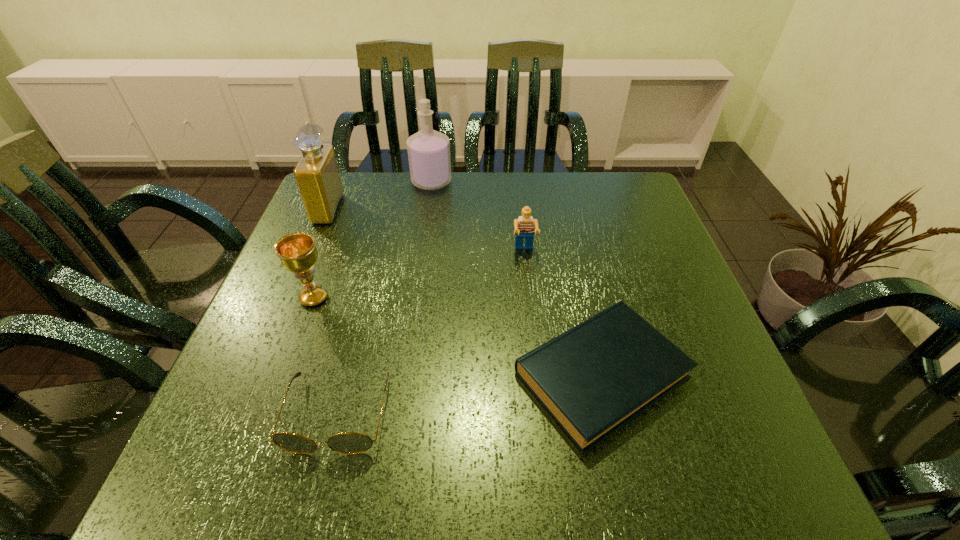
In the image, there is a desktop. Where is `free region at the near right corner`? This screenshot has width=960, height=540. free region at the near right corner is located at coordinates (670, 453).

At what (x,y) coordinates should I click in order to perform the action: click on free space between the third farthest object and the right perfume. Please return your answer as a coordinate pair (x, y). The height and width of the screenshot is (540, 960). Looking at the image, I should click on (478, 216).

The width and height of the screenshot is (960, 540). In order to click on vacant space that's between the shortest object and the fifth tallest object in this screenshot , I will do `click(469, 395)`.

Identify the location of blank region between the chalice and the sunglasses. (325, 356).

Locate an element on the screen. Image resolution: width=960 pixels, height=540 pixels. empty space between the fifth tallest object and the farther perfume is located at coordinates (385, 298).

You are a GUI agent. You are given a task and a screenshot of the screen. Output one action in this format:
    pyautogui.click(x=<x>, y=<y>)
    Task: Click on the empty space between the sunglasses and the shortest object
    This screenshot has height=540, width=960.
    Given the screenshot: What is the action you would take?
    pyautogui.click(x=469, y=395)

This screenshot has height=540, width=960. Identify the location of vacant area that lies between the shortest object and the fifth nearest object. (466, 292).

Find the location of a particular element. This screenshot has height=540, width=960. blank region between the sunglasses and the farthest object is located at coordinates (385, 298).

You are a GUI agent. You are given a task and a screenshot of the screen. Output one action in this format:
    pyautogui.click(x=<x>, y=<y>)
    Task: Click on the free space between the second farthest object and the fifth tallest object
    The height and width of the screenshot is (540, 960).
    Given the screenshot: What is the action you would take?
    pyautogui.click(x=333, y=312)

Find the location of `vacant area that lies between the fourth tallest object and the shortest object`. vacant area that lies between the fourth tallest object and the shortest object is located at coordinates (564, 313).